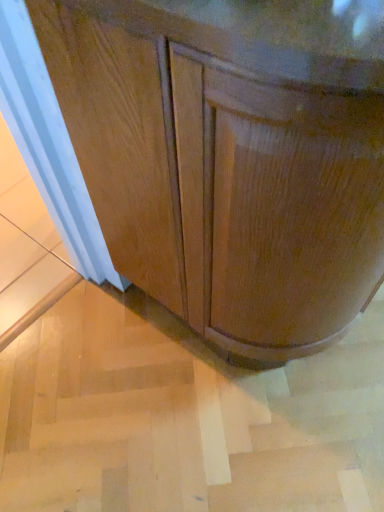
Where is `light brown wood stair at lower left`? The width and height of the screenshot is (384, 512). light brown wood stair at lower left is located at coordinates (184, 416).

This screenshot has height=512, width=384. Describe the element at coordinates (184, 416) in the screenshot. I see `light brown wood stair at lower left` at that location.

Measure the distance between point (29, 387) and camera.

1.13 meters.

What do you see at coordinates (223, 184) in the screenshot? The height and width of the screenshot is (512, 384). I see `glossy wood cabinet at center` at bounding box center [223, 184].

The image size is (384, 512). Find the location of `glossy wood cabinet at center`. glossy wood cabinet at center is located at coordinates (223, 184).

Where is `light brown wood stair at lower left`? The width and height of the screenshot is (384, 512). light brown wood stair at lower left is located at coordinates (184, 416).

In the image, is light brown wood stair at lower left on the left side or the right side of glossy wood cabinet at center?

From the image, it's evident that light brown wood stair at lower left is to the left of glossy wood cabinet at center.

Which object is more forward, light brown wood stair at lower left or glossy wood cabinet at center?

glossy wood cabinet at center is closer to the camera.

Considering the positions of points (194, 365) and (121, 252), is point (194, 365) farther from camera compared to point (121, 252)?

Yes, it is.

From the image's perspective, is light brown wood stair at lower left above or below glossy wood cabinet at center?

light brown wood stair at lower left is situated lower than glossy wood cabinet at center in the image.

From a real-world perspective, is light brown wood stair at lower left physically below glossy wood cabinet at center?

Yes, from a real-world perspective, light brown wood stair at lower left is below glossy wood cabinet at center.

Is light brown wood stair at lower left wider than glossy wood cabinet at center?

Yes, light brown wood stair at lower left is wider than glossy wood cabinet at center.

Consider the image. Does light brown wood stair at lower left have a greater height compared to glossy wood cabinet at center?

Incorrect, the height of light brown wood stair at lower left is not larger of that of glossy wood cabinet at center.

Is light brown wood stair at lower left bigger than glossy wood cabinet at center?

Incorrect, light brown wood stair at lower left is not larger than glossy wood cabinet at center.

Is light brown wood stair at lower left located outside glossy wood cabinet at center?

Yes.

Is light brown wood stair at lower left not near glossy wood cabinet at center?

That's not correct — light brown wood stair at lower left is a little close to glossy wood cabinet at center.

Is light brown wood stair at lower left oriented away from glossy wood cabinet at center?

A: No, light brown wood stair at lower left is not facing away from glossy wood cabinet at center.

From the picture: How different are the orientations of light brown wood stair at lower left and glossy wood cabinet at center in degrees?

The angular difference between light brown wood stair at lower left and glossy wood cabinet at center is 90 degrees.

The height and width of the screenshot is (512, 384). In order to click on stair on the left of glossy wood cabinet at center in this screenshot , I will do (184, 416).

Is glossy wood cabinet at center at the right side of light brown wood stair at lower left?

Indeed, glossy wood cabinet at center is positioned on the right side of light brown wood stair at lower left.

Considering the positions of objects glossy wood cabinet at center and light brown wood stair at lower left in the image provided, who is behind, glossy wood cabinet at center or light brown wood stair at lower left?

light brown wood stair at lower left is more distant.

Considering the points (255, 352) and (272, 449), which point is behind, point (255, 352) or point (272, 449)?

Point (272, 449)

From the image's perspective, is glossy wood cabinet at center positioned above or below light brown wood stair at lower left?

From the image's perspective, glossy wood cabinet at center appears above light brown wood stair at lower left.

From a real-world perspective, who is located higher, glossy wood cabinet at center or light brown wood stair at lower left?

glossy wood cabinet at center.

Considering the sizes of glossy wood cabinet at center and light brown wood stair at lower left in the image, is glossy wood cabinet at center wider or thinner than light brown wood stair at lower left?

Considering their sizes, glossy wood cabinet at center looks slimmer than light brown wood stair at lower left.

Which of these two, glossy wood cabinet at center or light brown wood stair at lower left, stands taller?

glossy wood cabinet at center.

Is glossy wood cabinet at center bigger than light brown wood stair at lower left?

Yes.

Is glossy wood cabinet at center not inside light brown wood stair at lower left?

Yes, glossy wood cabinet at center is not within light brown wood stair at lower left.

Is glossy wood cabinet at center in contact with light brown wood stair at lower left?

They are not placed beside each other.

Is glossy wood cabinet at center looking in the opposite direction of light brown wood stair at lower left?

glossy wood cabinet at center is not turned away from light brown wood stair at lower left.

Can you tell me how much glossy wood cabinet at center and light brown wood stair at lower left differ in facing direction?

The angle between the facing direction of glossy wood cabinet at center and the facing direction of light brown wood stair at lower left is 90 degrees.

How far apart are glossy wood cabinet at center and light brown wood stair at lower left?

The distance of glossy wood cabinet at center from light brown wood stair at lower left is 18.29 inches.

You are a GUI agent. You are given a task and a screenshot of the screen. Output one action in this format:
    pyautogui.click(x=<x>, y=<y>)
    Task: Click on the cabinetry on the right of light brown wood stair at lower left
    Image resolution: width=384 pixels, height=512 pixels.
    Given the screenshot: What is the action you would take?
    pyautogui.click(x=223, y=184)

Image resolution: width=384 pixels, height=512 pixels. Find the location of `stair behind the glossy wood cabinet at center`. stair behind the glossy wood cabinet at center is located at coordinates click(x=184, y=416).

Where is `cabinetry above the light brown wood stair at lower left (from a real-world perspective)`? Image resolution: width=384 pixels, height=512 pixels. cabinetry above the light brown wood stair at lower left (from a real-world perspective) is located at coordinates (223, 184).